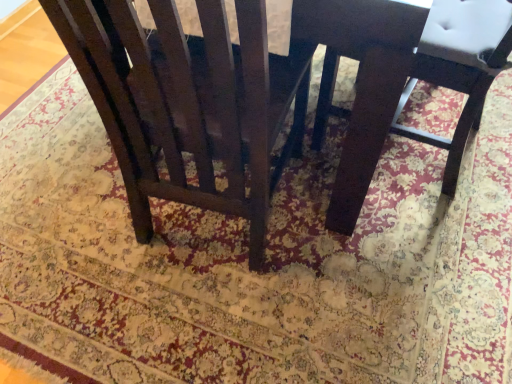
Question: Are matte dark wood chair at center, marked as the first chair in a right-to-left arrangement, and dark wood chair at center located far from each other?

Choices:
 (A) no
 (B) yes

Answer: (A)

Question: From a real-world perspective, is matte dark wood chair at center, marked as the 2th chair in a left-to-right arrangement, positioned under dark wood chair at center based on gravity?

Choices:
 (A) no
 (B) yes

Answer: (B)

Question: Is matte dark wood chair at center, marked as the 2th chair in a left-to-right arrangement, positioned before dark wood chair at center?

Choices:
 (A) yes
 (B) no

Answer: (B)

Question: Considering the relative sizes of matte dark wood chair at center, marked as the 2th chair in a left-to-right arrangement, and dark wood chair at center in the image provided, is matte dark wood chair at center, marked as the 2th chair in a left-to-right arrangement, taller than dark wood chair at center?

Choices:
 (A) no
 (B) yes

Answer: (A)

Question: Does matte dark wood chair at center, marked as the first chair in a right-to-left arrangement, have a lesser width compared to dark wood chair at center?

Choices:
 (A) no
 (B) yes

Answer: (B)

Question: Is matte dark wood chair at center, marked as the first chair in a right-to-left arrangement, next to dark wood chair at center?

Choices:
 (A) no
 (B) yes

Answer: (A)

Question: Does dark wood chair at center touch matte dark wood chair at center, positioned as the second chair in right-to-left order?

Choices:
 (A) no
 (B) yes

Answer: (A)

Question: Does dark wood chair at center have a lesser height compared to matte dark wood chair at center, the first chair in the left-to-right sequence?

Choices:
 (A) yes
 (B) no

Answer: (A)

Question: Is dark wood chair at center positioned behind matte dark wood chair at center, the first chair in the left-to-right sequence?

Choices:
 (A) yes
 (B) no

Answer: (A)

Question: Considering the relative sizes of dark wood chair at center and matte dark wood chair at center, the first chair in the left-to-right sequence, in the image provided, is dark wood chair at center bigger than matte dark wood chair at center, the first chair in the left-to-right sequence,?

Choices:
 (A) yes
 (B) no

Answer: (A)

Question: Is dark wood chair at center smaller than matte dark wood chair at center, positioned as the second chair in right-to-left order?

Choices:
 (A) yes
 (B) no

Answer: (B)

Question: Is matte dark wood chair at center, positioned as the second chair in right-to-left order, surrounded by dark wood chair at center?

Choices:
 (A) no
 (B) yes

Answer: (B)

Question: Considering the relative sizes of matte dark wood chair at center, marked as the first chair in a right-to-left arrangement, and matte dark wood chair at center, the first chair in the left-to-right sequence, in the image provided, is matte dark wood chair at center, marked as the first chair in a right-to-left arrangement, shorter than matte dark wood chair at center, the first chair in the left-to-right sequence,?

Choices:
 (A) yes
 (B) no

Answer: (A)